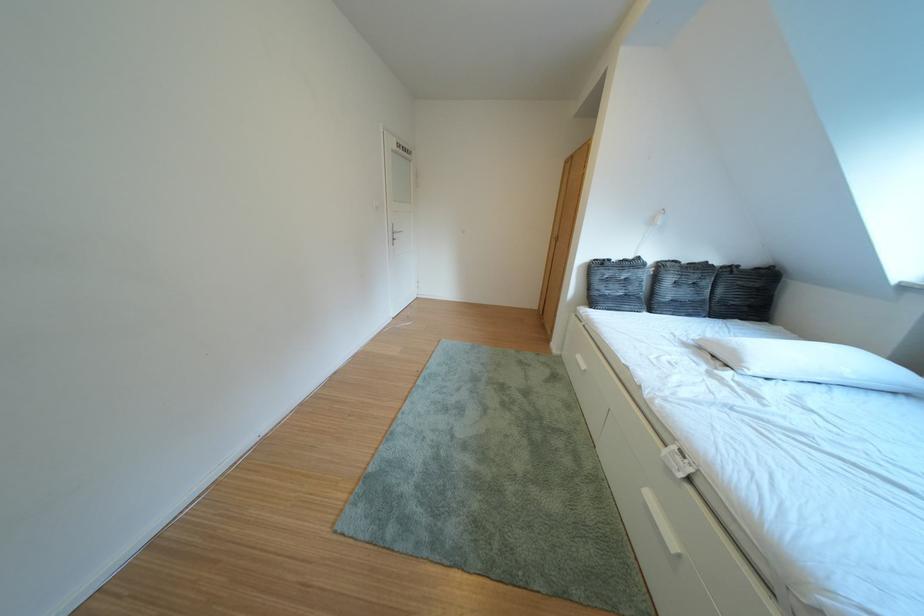
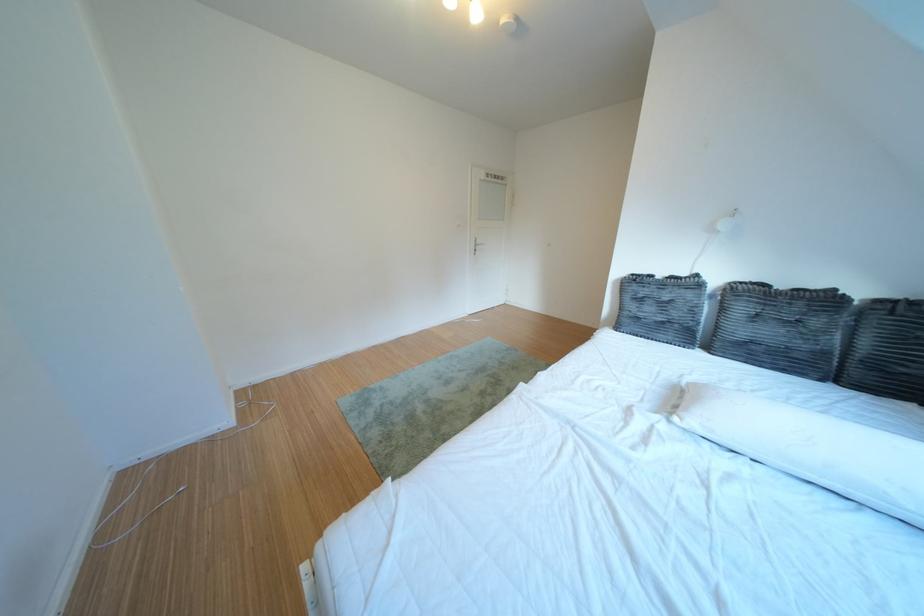
Find the pixel in the second image that matches (x=770, y=371) in the first image.

(707, 424)